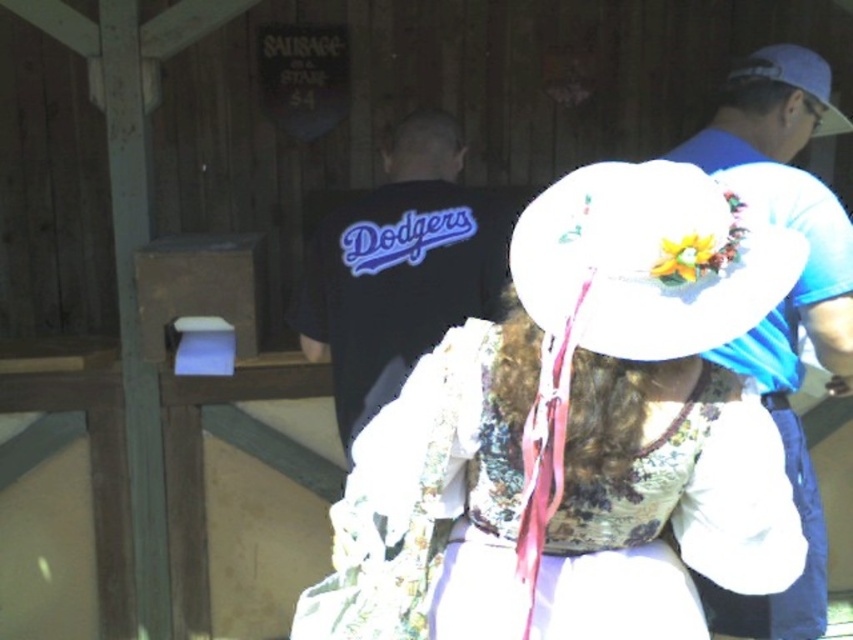
Question: Which of the following is the farthest from the observer?

Choices:
 (A) (784, 54)
 (B) (772, 492)
 (C) (468, 266)
 (D) (550, 349)

Answer: (C)

Question: Estimate the real-world distances between objects in this image. Which object is farther from the white fabric hat at upper right?

Choices:
 (A) white fabric cowboy hat at center
 (B) black fabric dodgers shirt at center
 (C) blue fabric shirt at right

Answer: (A)

Question: Based on their relative distances, which object is nearer to the black fabric dodgers shirt at center?

Choices:
 (A) white fabric hat at upper right
 (B) white fabric cowboy hat at center
 (C) white fabric hat at center

Answer: (C)

Question: Does blue fabric shirt at right appear on the left side of white fabric hat at upper right?

Choices:
 (A) yes
 (B) no

Answer: (A)

Question: Is blue fabric shirt at right above white fabric hat at upper right?

Choices:
 (A) yes
 (B) no

Answer: (B)

Question: Is blue fabric shirt at right below white fabric hat at upper right?

Choices:
 (A) no
 (B) yes

Answer: (B)